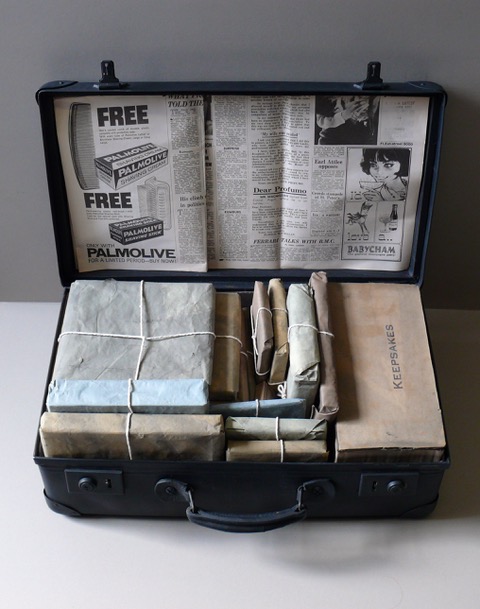
You are a GUI agent. You are given a task and a screenshot of the screen. Output one action in this format:
    pyautogui.click(x=<x>, y=<y>)
    Task: Click on the newspaper
    
    Given the screenshot: What is the action you would take?
    pyautogui.click(x=125, y=183)